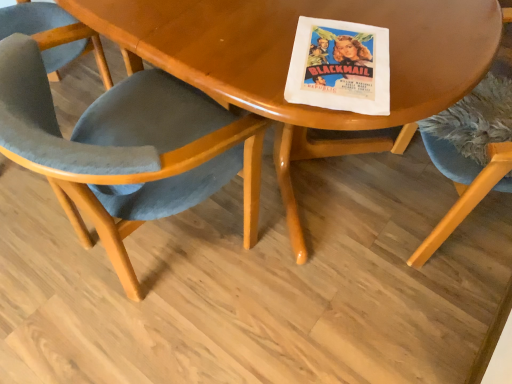
What do you see at coordinates (127, 150) in the screenshot?
I see `velvet blue chair at center, acting as the first chair starting from the left` at bounding box center [127, 150].

Locate an element on the screen. Image resolution: width=512 pixels, height=384 pixels. velvet blue chair at center, acting as the 2th chair starting from the right is located at coordinates (127, 150).

Based on their sizes in the image, would you say velvet blue chair at center, acting as the first chair starting from the left, is bigger or smaller than wooden table at center?

velvet blue chair at center, acting as the first chair starting from the left, is bigger than wooden table at center.

In the scene shown: Between velvet blue chair at center, acting as the first chair starting from the left, and wooden table at center, which one has more height?

Standing taller between the two is velvet blue chair at center, acting as the first chair starting from the left.

Between velvet blue chair at center, acting as the first chair starting from the left, and wooden table at center, which one appears on the left side from the viewer's perspective?

velvet blue chair at center, acting as the first chair starting from the left.

Is velvet blue chair at center, acting as the first chair starting from the left, placed right next to velvet blue chair at right, marked as the first chair in a right-to-left arrangement?

No, velvet blue chair at center, acting as the first chair starting from the left, is not making contact with velvet blue chair at right, marked as the first chair in a right-to-left arrangement.

In order to click on chair above the velvet blue chair at center, acting as the first chair starting from the left (from a real-world perspective) in this screenshot , I will do `click(462, 189)`.

From a real-world perspective, which is physically above, velvet blue chair at center, acting as the 2th chair starting from the right, or velvet blue chair at right, the second chair from the left?

From a 3D spatial view, velvet blue chair at right, the second chair from the left, is above.

Looking at this image, can you confirm if velvet blue chair at center, acting as the 2th chair starting from the right, is shorter than velvet blue chair at right, marked as the first chair in a right-to-left arrangement?

Yes, velvet blue chair at center, acting as the 2th chair starting from the right, is shorter than velvet blue chair at right, marked as the first chair in a right-to-left arrangement.

Is velvet blue chair at right, the second chair from the left, next to wooden table at center and touching it?

No, velvet blue chair at right, the second chair from the left, is not making contact with wooden table at center.

Is velvet blue chair at right, marked as the first chair in a right-to-left arrangement, facing away from wooden table at center?

velvet blue chair at right, marked as the first chair in a right-to-left arrangement, does not have its back to wooden table at center.

Consider the image. Visually, is velvet blue chair at right, marked as the first chair in a right-to-left arrangement, positioned to the left or to the right of wooden table at center?

From the image, it's evident that velvet blue chair at right, marked as the first chair in a right-to-left arrangement, is to the right of wooden table at center.

From a real-world perspective, is velvet blue chair at right, marked as the first chair in a right-to-left arrangement, positioned above or below wooden table at center?

velvet blue chair at right, marked as the first chair in a right-to-left arrangement, is above wooden table at center.

Based on the photo, is velvet blue chair at right, marked as the first chair in a right-to-left arrangement, situated inside velvet blue chair at center, acting as the first chair starting from the left, or outside?

The correct answer is: outside.

Who is more distant, velvet blue chair at right, marked as the first chair in a right-to-left arrangement, or velvet blue chair at center, acting as the 2th chair starting from the right?

velvet blue chair at right, marked as the first chair in a right-to-left arrangement.

Locate an element on the screen. chair lying on the left of velvet blue chair at right, the second chair from the left is located at coordinates (127, 150).

Is velvet blue chair at right, marked as the first chair in a right-to-left arrangement, wider than velvet blue chair at center, acting as the 2th chair starting from the right?

Yes.

Between wooden table at center and velvet blue chair at center, acting as the 2th chair starting from the right, which one is positioned behind?

Positioned behind is wooden table at center.

Measure the distance from wooden table at center to velvet blue chair at center, acting as the 2th chair starting from the right.

They are 11.91 inches apart.

From a real-world perspective, is wooden table at center positioned above or below velvet blue chair at center, acting as the first chair starting from the left?

Clearly, from a real-world perspective, wooden table at center is below velvet blue chair at center, acting as the first chair starting from the left.

From the image's perspective, between wooden table at center and velvet blue chair at center, acting as the first chair starting from the left, which one is located above?

velvet blue chair at center, acting as the first chair starting from the left, from the image's perspective.

Does wooden table at center have a greater height compared to velvet blue chair at right, the second chair from the left?

No, wooden table at center is not taller than velvet blue chair at right, the second chair from the left.

Between wooden table at center and velvet blue chair at right, the second chair from the left, which one appears on the right side from the viewer's perspective?

Positioned to the right is velvet blue chair at right, the second chair from the left.

Measure the distance between wooden table at center and velvet blue chair at right, marked as the first chair in a right-to-left arrangement.

wooden table at center is 18.07 inches from velvet blue chair at right, marked as the first chair in a right-to-left arrangement.

Can you confirm if wooden table at center is smaller than velvet blue chair at right, marked as the first chair in a right-to-left arrangement?

Yes.

You are a GUI agent. You are given a task and a screenshot of the screen. Output one action in this format:
    pyautogui.click(x=<x>, y=<y>)
    Task: Click on the 1st chair above when counting from the wooden table at center (from the image's perspective)
    Image resolution: width=512 pixels, height=384 pixels.
    Given the screenshot: What is the action you would take?
    pyautogui.click(x=127, y=150)

Find the location of a particular element. Image resolution: width=512 pixels, height=384 pixels. chair below the velvet blue chair at right, marked as the first chair in a right-to-left arrangement (from the image's perspective) is located at coordinates pos(127,150).

Based on their spatial positions, is velvet blue chair at right, marked as the first chair in a right-to-left arrangement, or velvet blue chair at center, acting as the 2th chair starting from the right, closer to wooden table at center?

Among the two, velvet blue chair at center, acting as the 2th chair starting from the right, is located nearer to wooden table at center.

Considering their positions, is wooden table at center positioned closer to velvet blue chair at center, acting as the 2th chair starting from the right, than velvet blue chair at right, marked as the first chair in a right-to-left arrangement?

The object closer to velvet blue chair at center, acting as the 2th chair starting from the right, is wooden table at center.

In the scene shown: When comparing their distances from velvet blue chair at right, marked as the first chair in a right-to-left arrangement, does velvet blue chair at center, acting as the 2th chair starting from the right, or wooden table at center seem further?

The object further to velvet blue chair at right, marked as the first chair in a right-to-left arrangement, is velvet blue chair at center, acting as the 2th chair starting from the right.

Which object lies nearer to the anchor point velvet blue chair at center, acting as the first chair starting from the left, velvet blue chair at right, the second chair from the left, or wooden table at center?

Based on the image, wooden table at center appears to be nearer to velvet blue chair at center, acting as the first chair starting from the left.

Based on their spatial positions, is velvet blue chair at center, acting as the 2th chair starting from the right, or velvet blue chair at right, the second chair from the left, further from wooden table at center?

velvet blue chair at right, the second chair from the left.

Based on their spatial positions, is wooden table at center or velvet blue chair at center, acting as the 2th chair starting from the right, further from velvet blue chair at right, marked as the first chair in a right-to-left arrangement?

velvet blue chair at center, acting as the 2th chair starting from the right, is further to velvet blue chair at right, marked as the first chair in a right-to-left arrangement.

Identify the location of table between velvet blue chair at center, acting as the first chair starting from the left, and velvet blue chair at right, marked as the first chair in a right-to-left arrangement, from left to right. The image size is (512, 384). (289, 60).